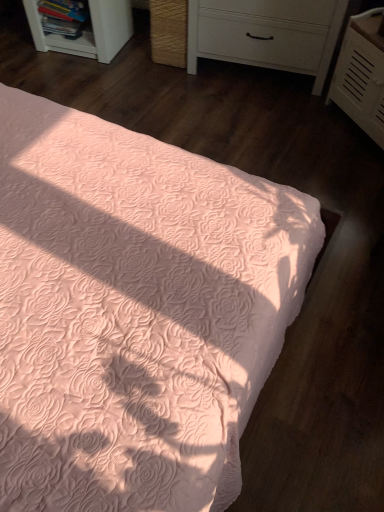
The height and width of the screenshot is (512, 384). Describe the element at coordinates (266, 34) in the screenshot. I see `white matte chest of drawers at upper center, which is the second chest of drawers in right-to-left order` at that location.

Image resolution: width=384 pixels, height=512 pixels. What do you see at coordinates (361, 74) in the screenshot? I see `white textured chest of drawers at upper right, which ranks as the 1th chest of drawers in right-to-left order` at bounding box center [361, 74].

I want to click on peach quilted bed at center, so click(x=134, y=312).

You are a GUI agent. You are given a task and a screenshot of the screen. Output one action in this format:
    pyautogui.click(x=<x>, y=<y>)
    Task: Click on the white plastic shelf at upper left
    
    Given the screenshot: What is the action you would take?
    pyautogui.click(x=88, y=31)

Locate an element on the screen. This screenshot has height=512, width=384. white matte chest of drawers at upper center, which ranks as the first chest of drawers in left-to-right order is located at coordinates (266, 34).

Is white textured chest of drawers at upper right, the 2th chest of drawers in the left-to-right sequence, situated inside peach quilted bed at center or outside?

white textured chest of drawers at upper right, the 2th chest of drawers in the left-to-right sequence, cannot be found inside peach quilted bed at center.

From the picture: Considering the relative sizes of white textured chest of drawers at upper right, which ranks as the 1th chest of drawers in right-to-left order, and peach quilted bed at center in the image provided, is white textured chest of drawers at upper right, which ranks as the 1th chest of drawers in right-to-left order, thinner than peach quilted bed at center?

Indeed, white textured chest of drawers at upper right, which ranks as the 1th chest of drawers in right-to-left order, has a lesser width compared to peach quilted bed at center.

In the scene shown: How many degrees apart are the facing directions of white plastic shelf at upper left and white textured chest of drawers at upper right, the 2th chest of drawers in the left-to-right sequence?

49.7 degrees.

Considering the relative positions of white plastic shelf at upper left and white textured chest of drawers at upper right, the 2th chest of drawers in the left-to-right sequence, in the image provided, is white plastic shelf at upper left to the left of white textured chest of drawers at upper right, the 2th chest of drawers in the left-to-right sequence, from the viewer's perspective?

Indeed, white plastic shelf at upper left is positioned on the left side of white textured chest of drawers at upper right, the 2th chest of drawers in the left-to-right sequence.

Between white plastic shelf at upper left and white textured chest of drawers at upper right, which ranks as the 1th chest of drawers in right-to-left order, which one is positioned in front?

white textured chest of drawers at upper right, which ranks as the 1th chest of drawers in right-to-left order, is more forward.

Between white plastic shelf at upper left and white textured chest of drawers at upper right, the 2th chest of drawers in the left-to-right sequence, which one has less height?

white plastic shelf at upper left is shorter.

Is peach quilted bed at center in front of white plastic shelf at upper left?

Yes, it is in front of white plastic shelf at upper left.

From a real-world perspective, which is physically below, peach quilted bed at center or white plastic shelf at upper left?

From a 3D spatial view, peach quilted bed at center is below.

Is peach quilted bed at center smaller than white plastic shelf at upper left?

No.

Is peach quilted bed at center facing away from white plastic shelf at upper left?

No.

Is white matte chest of drawers at upper center, which ranks as the first chest of drawers in left-to-right order, facing towards peach quilted bed at center?

Yes.

The width and height of the screenshot is (384, 512). What are the coordinates of `bed below the white matte chest of drawers at upper center, which ranks as the first chest of drawers in left-to-right order (from a real-world perspective)` in the screenshot? It's located at (134, 312).

Based on the photo, is peach quilted bed at center not near white matte chest of drawers at upper center, which ranks as the first chest of drawers in left-to-right order?

peach quilted bed at center is far away from white matte chest of drawers at upper center, which ranks as the first chest of drawers in left-to-right order.

Considering the sizes of objects peach quilted bed at center and white matte chest of drawers at upper center, which ranks as the first chest of drawers in left-to-right order, in the image provided, who is shorter, peach quilted bed at center or white matte chest of drawers at upper center, which ranks as the first chest of drawers in left-to-right order,?

With less height is peach quilted bed at center.

From the image's perspective, does peach quilted bed at center appear lower than white matte chest of drawers at upper center, which is the second chest of drawers in right-to-left order?

Yes, from the image's perspective, peach quilted bed at center is beneath white matte chest of drawers at upper center, which is the second chest of drawers in right-to-left order.

From a real-world perspective, who is located lower, peach quilted bed at center or white matte chest of drawers at upper center, which ranks as the first chest of drawers in left-to-right order?

From a 3D spatial view, peach quilted bed at center is below.

Considering the positions of objects peach quilted bed at center and white textured chest of drawers at upper right, the 2th chest of drawers in the left-to-right sequence, in the image provided, who is in front, peach quilted bed at center or white textured chest of drawers at upper right, the 2th chest of drawers in the left-to-right sequence,?

peach quilted bed at center is in front.

Who is bigger, peach quilted bed at center or white textured chest of drawers at upper right, which ranks as the 1th chest of drawers in right-to-left order?

peach quilted bed at center is bigger.

Is peach quilted bed at center aimed at white textured chest of drawers at upper right, the 2th chest of drawers in the left-to-right sequence?

No, peach quilted bed at center is not facing towards white textured chest of drawers at upper right, the 2th chest of drawers in the left-to-right sequence.

How many degrees apart are the facing directions of peach quilted bed at center and white textured chest of drawers at upper right, which ranks as the 1th chest of drawers in right-to-left order?

40.6 degrees separate the facing orientations of peach quilted bed at center and white textured chest of drawers at upper right, which ranks as the 1th chest of drawers in right-to-left order.

Does white plastic shelf at upper left have a lesser width compared to peach quilted bed at center?

Correct, the width of white plastic shelf at upper left is less than that of peach quilted bed at center.

In the image, is white plastic shelf at upper left positioned in front of or behind peach quilted bed at center?

white plastic shelf at upper left is positioned farther from the viewer than peach quilted bed at center.

Is white plastic shelf at upper left not inside peach quilted bed at center?

That's correct, white plastic shelf at upper left is outside of peach quilted bed at center.

Are white plastic shelf at upper left and peach quilted bed at center making contact?

No, white plastic shelf at upper left is not touching peach quilted bed at center.

This screenshot has width=384, height=512. What are the coordinates of `the 2nd chest of drawers to the right of the peach quilted bed at center, starting your count from the anchor` in the screenshot? It's located at (361, 74).

From a real-world perspective, count 1st chest of drawerss upward from the white plastic shelf at upper left and point to it. Please provide its 2D coordinates.

[(361, 74)]

When comparing their distances from white textured chest of drawers at upper right, which ranks as the 1th chest of drawers in right-to-left order, does peach quilted bed at center or white matte chest of drawers at upper center, which is the second chest of drawers in right-to-left order, seem further?

Based on the image, peach quilted bed at center appears to be further to white textured chest of drawers at upper right, which ranks as the 1th chest of drawers in right-to-left order.

Which object lies nearer to the anchor point white plastic shelf at upper left, peach quilted bed at center or white matte chest of drawers at upper center, which is the second chest of drawers in right-to-left order?

white matte chest of drawers at upper center, which is the second chest of drawers in right-to-left order, is closer to white plastic shelf at upper left.

From the image, which object appears to be nearer to white textured chest of drawers at upper right, which ranks as the 1th chest of drawers in right-to-left order, white matte chest of drawers at upper center, which ranks as the first chest of drawers in left-to-right order, or white plastic shelf at upper left?

white matte chest of drawers at upper center, which ranks as the first chest of drawers in left-to-right order, lies closer to white textured chest of drawers at upper right, which ranks as the 1th chest of drawers in right-to-left order, than the other object.

When comparing their distances from white textured chest of drawers at upper right, the 2th chest of drawers in the left-to-right sequence, does white matte chest of drawers at upper center, which ranks as the first chest of drawers in left-to-right order, or peach quilted bed at center seem further?

peach quilted bed at center is further to white textured chest of drawers at upper right, the 2th chest of drawers in the left-to-right sequence.

Considering their positions, is white plastic shelf at upper left positioned further to peach quilted bed at center than white textured chest of drawers at upper right, the 2th chest of drawers in the left-to-right sequence?

Based on the image, white plastic shelf at upper left appears to be further to peach quilted bed at center.

When comparing their distances from white matte chest of drawers at upper center, which ranks as the first chest of drawers in left-to-right order, does white plastic shelf at upper left or peach quilted bed at center seem further?

The object further to white matte chest of drawers at upper center, which ranks as the first chest of drawers in left-to-right order, is peach quilted bed at center.

In the scene shown: Based on their spatial positions, is white plastic shelf at upper left or white textured chest of drawers at upper right, the 2th chest of drawers in the left-to-right sequence, closer to white matte chest of drawers at upper center, which is the second chest of drawers in right-to-left order?

→ white textured chest of drawers at upper right, the 2th chest of drawers in the left-to-right sequence.

When comparing their distances from white matte chest of drawers at upper center, which ranks as the first chest of drawers in left-to-right order, does white textured chest of drawers at upper right, the 2th chest of drawers in the left-to-right sequence, or peach quilted bed at center seem closer?

white textured chest of drawers at upper right, the 2th chest of drawers in the left-to-right sequence, lies closer to white matte chest of drawers at upper center, which ranks as the first chest of drawers in left-to-right order, than the other object.

Identify the location of chest of drawers between white plastic shelf at upper left and white textured chest of drawers at upper right, the 2th chest of drawers in the left-to-right sequence. (266, 34).

Image resolution: width=384 pixels, height=512 pixels. I want to click on bed situated between white plastic shelf at upper left and white textured chest of drawers at upper right, the 2th chest of drawers in the left-to-right sequence, from left to right, so click(134, 312).

You are a GUI agent. You are given a task and a screenshot of the screen. Output one action in this format:
    pyautogui.click(x=<x>, y=<y>)
    Task: Click on the chest of drawers between peach quilted bed at center and white textured chest of drawers at upper right, the 2th chest of drawers in the left-to-right sequence, in the horizontal direction
    The width and height of the screenshot is (384, 512).
    Given the screenshot: What is the action you would take?
    pyautogui.click(x=266, y=34)